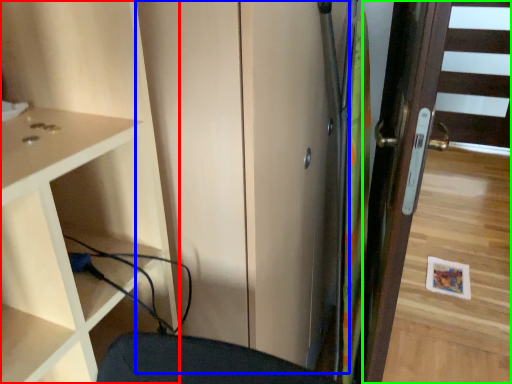
Question: Based on their relative distances, which object is farther from cupboard (highlighted by a red box)? Choose from screen door (highlighted by a blue box) and door (highlighted by a green box).

Choices:
 (A) screen door
 (B) door

Answer: (B)